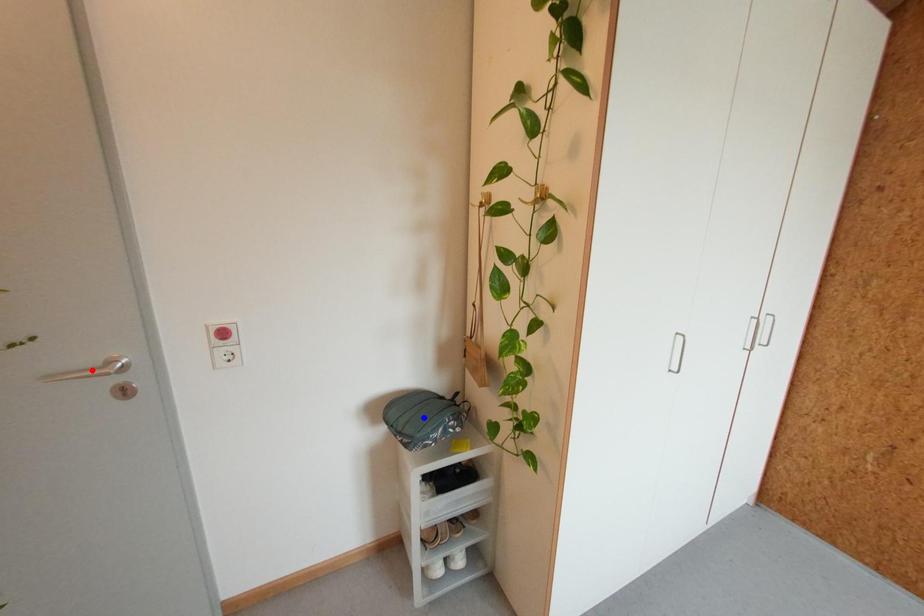
Question: Which of the two points in the image is closer to the camera?

Choices:
 (A) Blue point is closer.
 (B) Red point is closer.

Answer: (B)